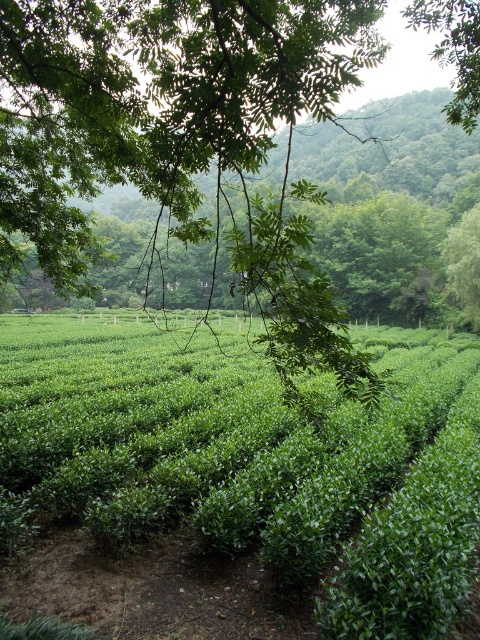
Which is above, green leafy hedge at center or green leafy tree at upper left?

green leafy tree at upper left is above.

Which is more to the right, green leafy hedge at center or green leafy tree at upper left?

Positioned to the right is green leafy hedge at center.

Who is more distant from viewer, (6, 502) or (465, 20)?

The point (6, 502) is more distant.

The height and width of the screenshot is (640, 480). What are the coordinates of `green leafy hedge at center` in the screenshot? It's located at (203, 442).